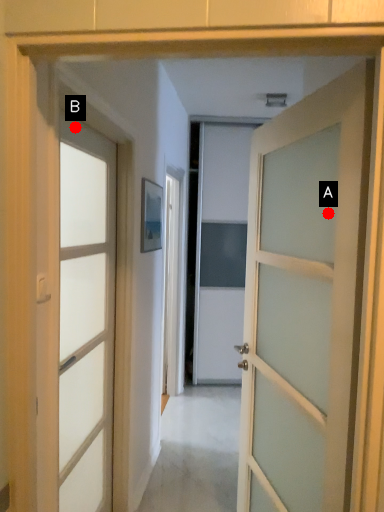
Question: Two points are circled on the image, labeled by A and B beside each circle. Among these points, which one is nearest to the camera?

Choices:
 (A) A is closer
 (B) B is closer

Answer: (A)